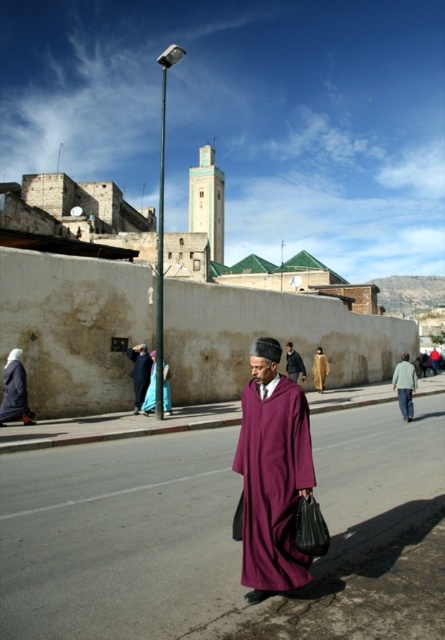
Question: Is dark purple fabric at center below tan woolen shawl at center?

Choices:
 (A) yes
 (B) no

Answer: (B)

Question: Does purple woolen robe at center have a larger size compared to blue silk dress at center?

Choices:
 (A) yes
 (B) no

Answer: (A)

Question: Which object is positioned farthest from the dark purple fabric at center?

Choices:
 (A) purple woolen robe at center
 (B) dark blue fabric headscarf at lower left
 (C) blue silk dress at center
 (D) purple fabric at center

Answer: (A)

Question: Which object is the farthest from the purple woolen robe at center?

Choices:
 (A) dark purple fabric at center
 (B) tan woolen shawl at center

Answer: (B)

Question: Does blue silk dress at center appear under tan woolen shawl at center?

Choices:
 (A) no
 (B) yes

Answer: (B)

Question: Which object is positioned closest to the dark blue fabric headscarf at lower left?

Choices:
 (A) purple fabric at center
 (B) dark purple fabric at center
 (C) blue silk dress at center
 (D) tan woolen shawl at center

Answer: (B)